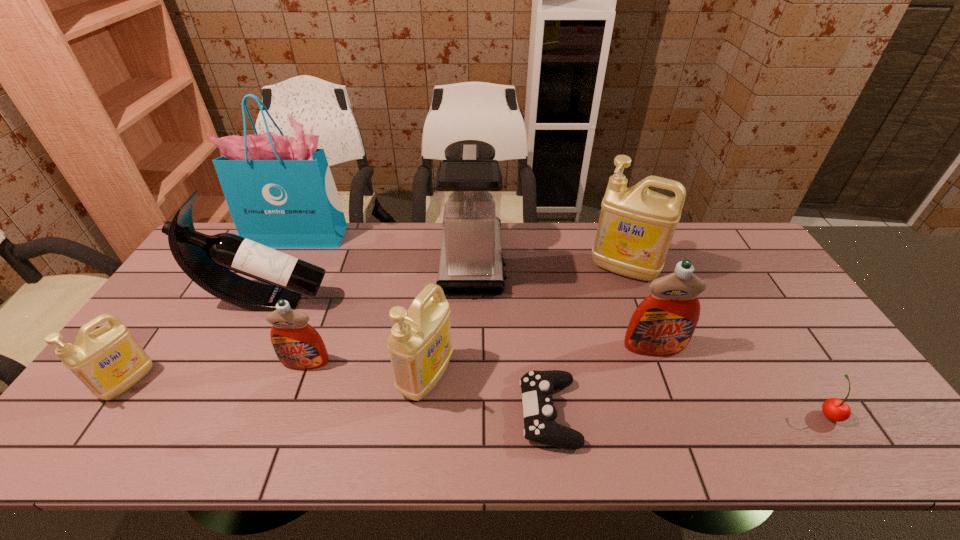
The width and height of the screenshot is (960, 540). I want to click on empty location between the ninth tallest object and the left red detergent, so point(566,388).

Locate an element on the screen. free area in between the black wine bottle and the second biggest beige detergent is located at coordinates (348, 339).

You are a GUI agent. You are given a task and a screenshot of the screen. Output one action in this format:
    pyautogui.click(x=<x>, y=<y>)
    Task: Click on the object identified as the third closest to the wine bottle
    The width and height of the screenshot is (960, 540).
    Given the screenshot: What is the action you would take?
    (x=280, y=191)

Image resolution: width=960 pixels, height=540 pixels. What are the coordinates of `object identified as the second closest to the coffee maker` in the screenshot? It's located at (636, 225).

This screenshot has width=960, height=540. I want to click on detergent object that ranks as the closest to the second biggest beige detergent, so pyautogui.click(x=298, y=345).

At what (x,y) coordinates should I click in order to perform the action: click on detergent that is the third nearest to the smaller red detergent. Please return your answer as a coordinate pair (x, y). This screenshot has width=960, height=540. Looking at the image, I should click on (663, 323).

At what (x,y) coordinates should I click in order to perform the action: click on the third closest beige detergent to the bigger red detergent. Please return your answer as a coordinate pair (x, y). This screenshot has height=540, width=960. Looking at the image, I should click on (109, 360).

The image size is (960, 540). What are the coordinates of `beige detergent that is the closest to the farthest beige detergent` in the screenshot? It's located at (420, 348).

The height and width of the screenshot is (540, 960). Identify the location of vacant space that satisfies the following two spatial constraints: 1. at the front of the coffee maker where the controls are located; 2. on the front surface of the second detergent from left to right. (470, 362).

The width and height of the screenshot is (960, 540). I want to click on vacant space that satisfies the following two spatial constraints: 1. at the front of the coffee maker where the controls are located; 2. on the front side of the smallest beige detergent, so click(470, 382).